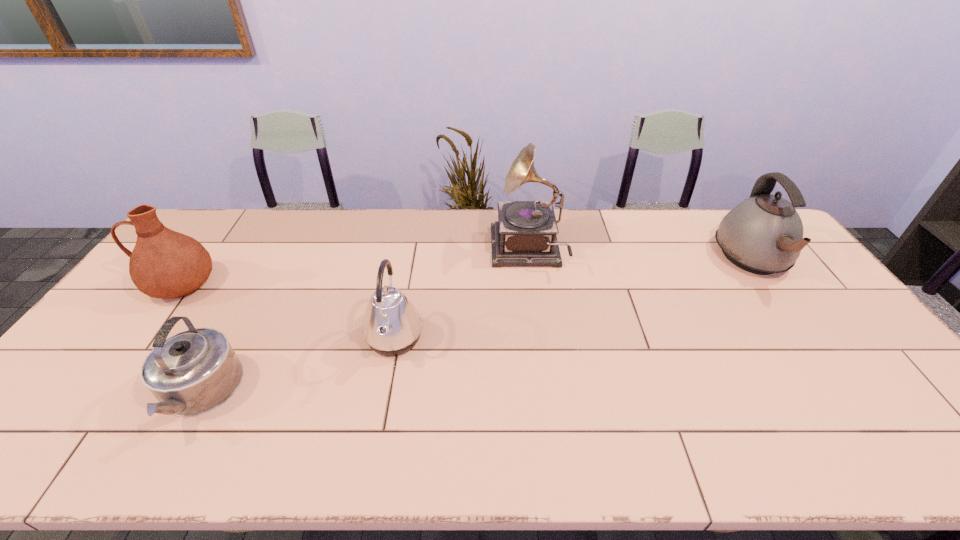
Identify the location of free spot between the tallest object and the second kettle from left to right. This screenshot has width=960, height=540. (461, 295).

Locate which object ranks third in proximity to the third object from right to left. Please provide its 2D coordinates. Your answer should be formatted as a tuple, i.e. [(x, y)], where the tuple contains the x and y coordinates of a point satisfying the conditions above.

[(164, 264)]

Identify which object is the closest to the rightmost object. Please provide its 2D coordinates. Your answer should be formatted as a tuple, i.e. [(x, y)], where the tuple contains the x and y coordinates of a point satisfying the conditions above.

[(525, 234)]

Identify the location of kettle that is the second nearest to the record player. (763, 234).

Image resolution: width=960 pixels, height=540 pixels. I want to click on kettle that is the third nearest to the record player, so click(x=193, y=372).

Where is `free space that satisfies the following two spatial constraints: 1. on the horn of the tallest object; 2. with the spout at the front of the shortest object`? This screenshot has width=960, height=540. free space that satisfies the following two spatial constraints: 1. on the horn of the tallest object; 2. with the spout at the front of the shortest object is located at coordinates (545, 394).

In order to click on vacant region that satisfies the following two spatial constraints: 1. from the spout of the third object from left to right; 2. with the spout at the front of the fourth object from right to left in this screenshot , I will do `click(384, 394)`.

Locate an element on the screen. vacant space that satisfies the following two spatial constraints: 1. on the horn of the record player; 2. with the spout at the front of the shortest kettle is located at coordinates (545, 394).

Identify the location of vacant region that satisfies the following two spatial constraints: 1. on the horn of the fourth object from left to right; 2. with the spout at the front of the fourth object from right to left. The image size is (960, 540). (545, 394).

Where is `vacant position in the image that satisfies the following two spatial constraints: 1. at the spout of the farthest kettle; 2. from the spout of the third object from right to left`? The image size is (960, 540). vacant position in the image that satisfies the following two spatial constraints: 1. at the spout of the farthest kettle; 2. from the spout of the third object from right to left is located at coordinates (810, 339).